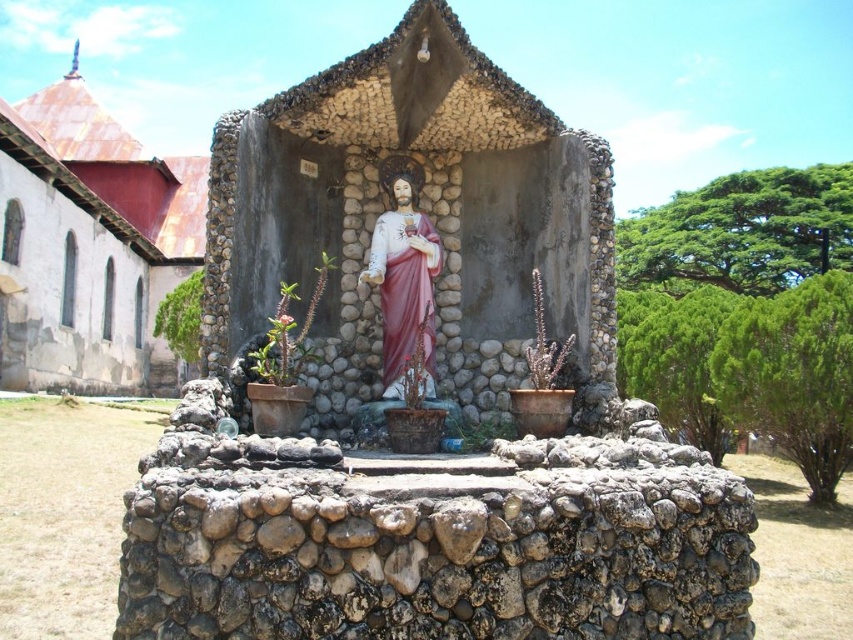
Question: In this image, where is rusty metal roof at left located relative to matte pink statue at center?

Choices:
 (A) above
 (B) below

Answer: (A)

Question: Among these objects, which one is farthest from the camera?

Choices:
 (A) rusty metal roof at left
 (B) matte pink statue at center

Answer: (A)

Question: Which point is closer to the camera?

Choices:
 (A) rusty metal roof at left
 (B) matte pink statue at center

Answer: (B)

Question: Which point is farther to the camera?

Choices:
 (A) rusty metal roof at left
 (B) matte pink statue at center

Answer: (A)

Question: Can you confirm if rusty metal roof at left is positioned to the right of matte pink statue at center?

Choices:
 (A) no
 (B) yes

Answer: (A)

Question: Where is rusty metal roof at left located in relation to matte pink statue at center in the image?

Choices:
 (A) left
 (B) right

Answer: (A)